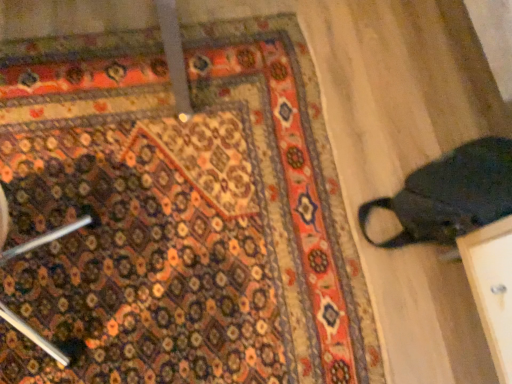
Find the location of `vacant space in carpeted mat at lower left (from a real-world perspective)`. vacant space in carpeted mat at lower left (from a real-world perspective) is located at coordinates 194,196.